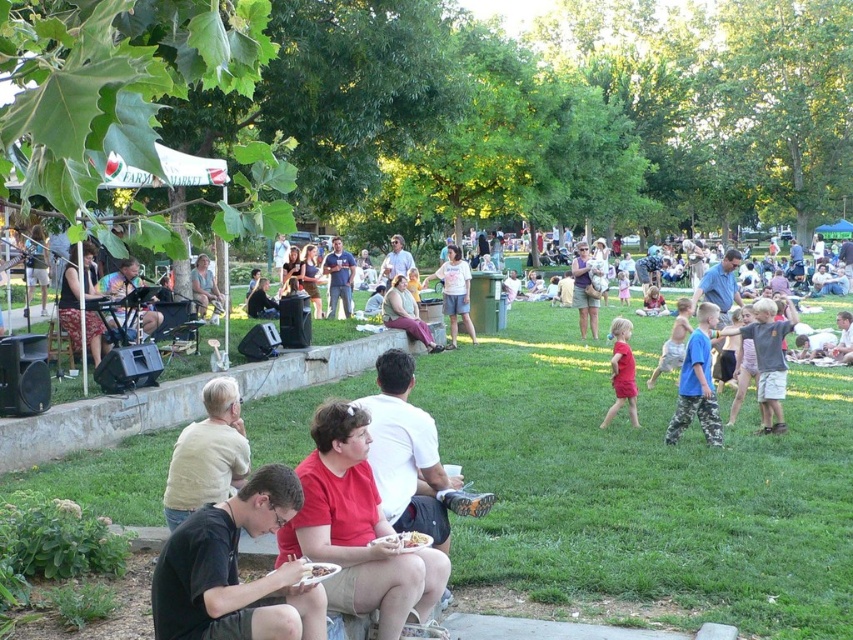
Which of these two, white cotton shirt at center or matte blue shirt at center, stands taller?

With more height is white cotton shirt at center.

Is white cotton shirt at center positioned in front of matte blue shirt at center?

Yes, white cotton shirt at center is in front of matte blue shirt at center.

Who is more forward, (451,288) or (334,310)?

Point (451,288) is more forward.

You are a GUI agent. You are given a task and a screenshot of the screen. Output one action in this format:
    pyautogui.click(x=<x>, y=<y>)
    Task: Click on the white cotton shirt at center
    This screenshot has width=853, height=640.
    Given the screenshot: What is the action you would take?
    pyautogui.click(x=454, y=292)

Which is behind, point (135, 259) or point (677, 332)?

The point (135, 259) is more distant.

Can you confirm if shiny silver keyboard at center is bigger than camouflage shorts at center?

Indeed, shiny silver keyboard at center has a larger size compared to camouflage shorts at center.

Is point (96, 288) less distant than point (669, 340)?

No, it is behind (669, 340).

Locate an element on the screen. shiny silver keyboard at center is located at coordinates (120, 280).

Which is above, white cotton shirt at center or matte brown purse at center?

matte brown purse at center is higher up.

Find the location of `white cotton shirt at center`. white cotton shirt at center is located at coordinates pyautogui.click(x=454, y=292).